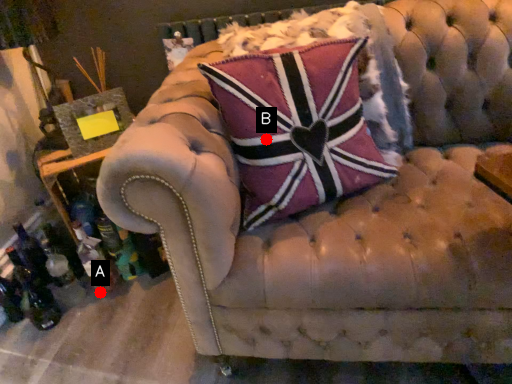
Question: Two points are circled on the image, labeled by A and B beside each circle. Which point appears farthest from the camera in this image?

Choices:
 (A) A is further
 (B) B is further

Answer: (A)